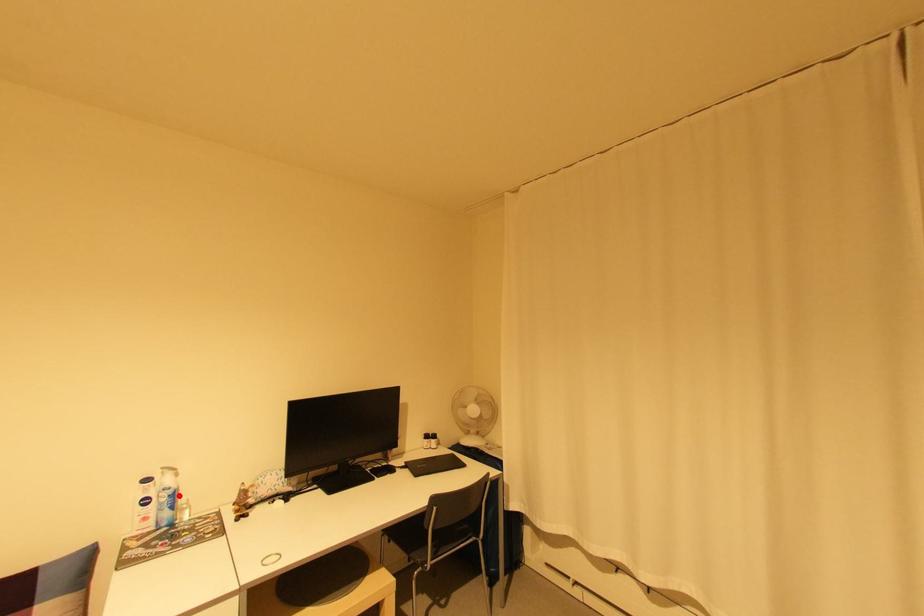
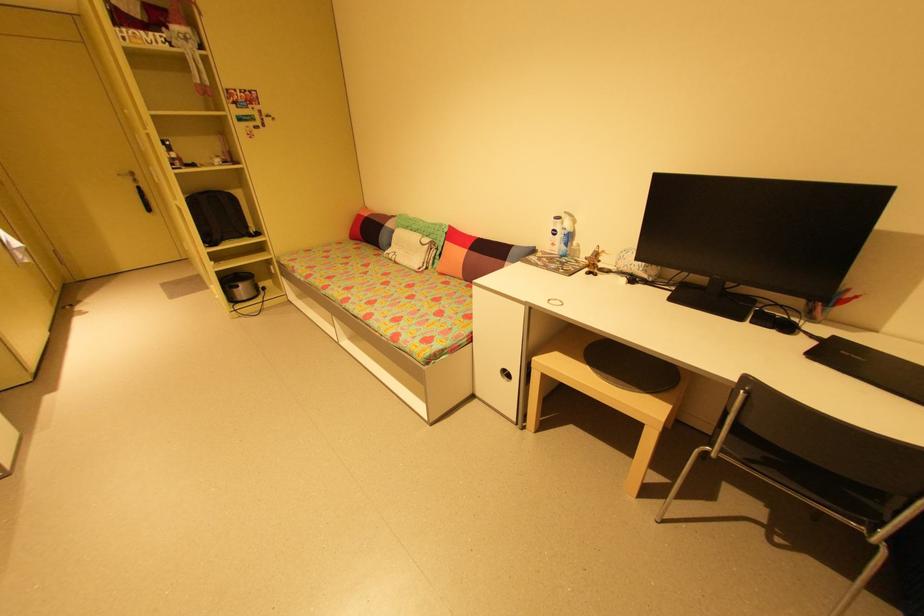
Find the pixel in the second image that matches the highlighted location in the first image.

(574, 237)